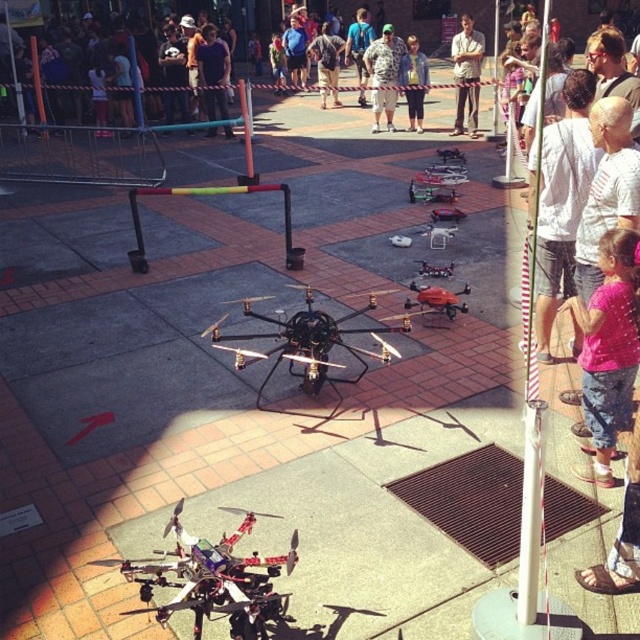
Question: Which object appears closest to the camera in this image?

Choices:
 (A) light brown leather jacket at center
 (B) polished metallic drone at lower center

Answer: (B)

Question: Which is farther from the polished metallic drone at lower center?

Choices:
 (A) camouflage-patterned shirt at center
 (B) matte black drone at center
 (C) pink fabric shirt at lower right
 (D) dark blue shirt at center

Answer: (A)

Question: Is metallic hexacopter at center positioned at the back of light brown leather jacket at center?

Choices:
 (A) yes
 (B) no

Answer: (B)

Question: Is matte black clothing at upper center to the right of dark blue shirt at center from the viewer's perspective?

Choices:
 (A) no
 (B) yes

Answer: (A)

Question: Which is nearer to the matte black drone at center?

Choices:
 (A) pink fabric shirt at lower right
 (B) matte black clothing at upper center
 (C) denim jacket at center

Answer: (A)

Question: Is camouflage-patterned shirt at center positioned behind matte black drone at center?

Choices:
 (A) yes
 (B) no

Answer: (A)